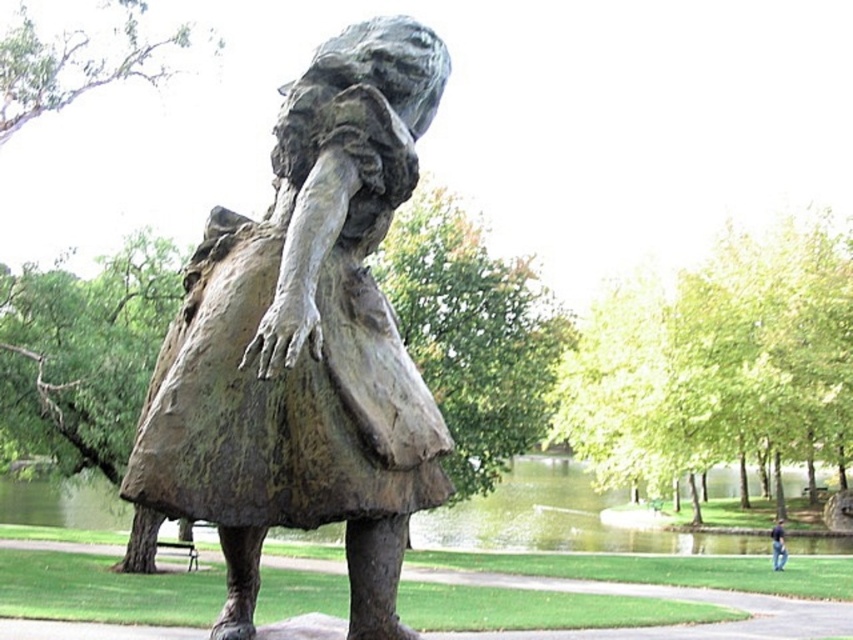
Who is positioned more to the right, bronze statue at center or dark blue jeans at lower right?

From the viewer's perspective, dark blue jeans at lower right appears more on the right side.

Which is behind, point (408, 19) or point (779, 536)?

Point (779, 536)

Locate an element on the screen. Image resolution: width=853 pixels, height=640 pixels. bronze statue at center is located at coordinates (306, 340).